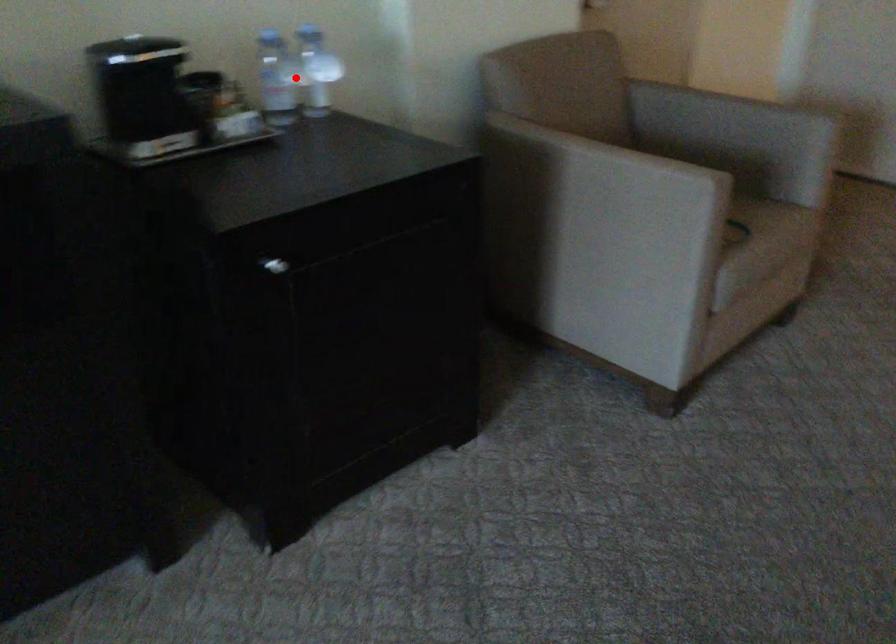
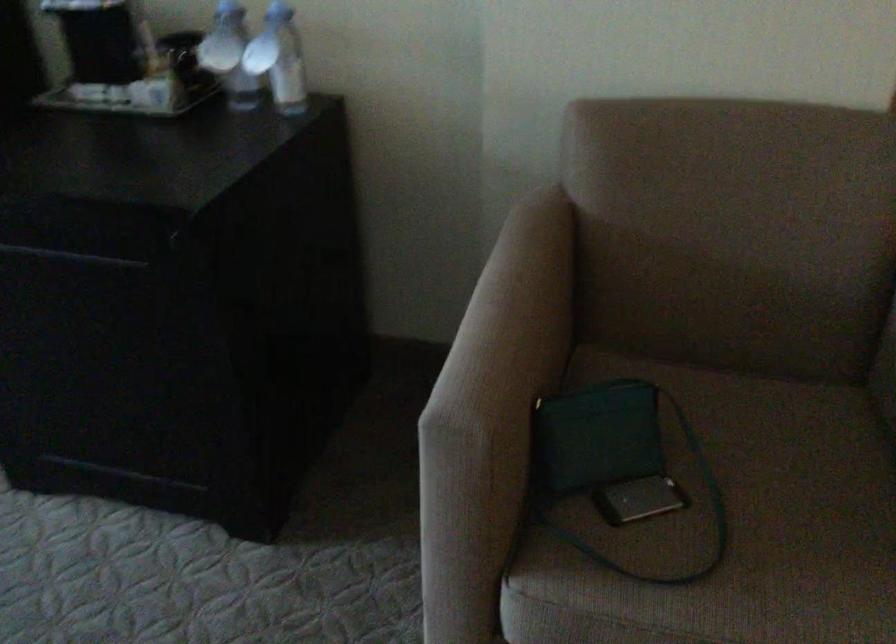
Question: I am providing you with two images of the same scene from different viewpoints. Given a red point in image1, look at the same physical point in image2. Is it:

Choices:
 (A) Closer to the viewpoint
 (B) Farther from the viewpoint

Answer: (A)